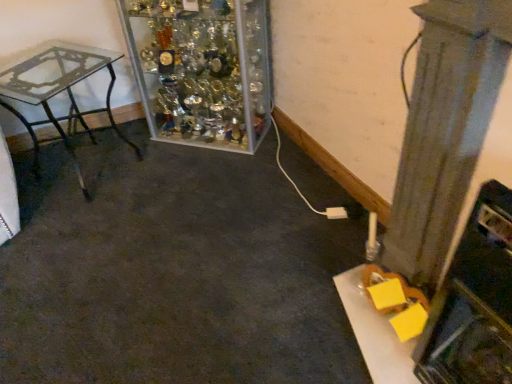
Question: Is smooth gray pillar at right to the right of clear glass table at left from the viewer's perspective?

Choices:
 (A) no
 (B) yes

Answer: (B)

Question: From a real-world perspective, does smooth gray pillar at right stand above clear glass table at left?

Choices:
 (A) no
 (B) yes

Answer: (B)

Question: Is clear glass table at left at the back of smooth gray pillar at right?

Choices:
 (A) yes
 (B) no

Answer: (B)

Question: Can you confirm if smooth gray pillar at right is taller than clear glass table at left?

Choices:
 (A) no
 (B) yes

Answer: (B)

Question: Does smooth gray pillar at right have a lesser height compared to clear glass table at left?

Choices:
 (A) no
 (B) yes

Answer: (A)

Question: Can you confirm if smooth gray pillar at right is bigger than clear glass table at left?

Choices:
 (A) yes
 (B) no

Answer: (B)

Question: From a real-world perspective, is smooth gray pillar at right located higher than clear glass trophy case at upper center?

Choices:
 (A) no
 (B) yes

Answer: (B)

Question: Can you confirm if smooth gray pillar at right is thinner than clear glass trophy case at upper center?

Choices:
 (A) no
 (B) yes

Answer: (B)

Question: From the image's perspective, is smooth gray pillar at right under clear glass trophy case at upper center?

Choices:
 (A) yes
 (B) no

Answer: (A)

Question: Does smooth gray pillar at right have a larger size compared to clear glass trophy case at upper center?

Choices:
 (A) no
 (B) yes

Answer: (A)

Question: Is smooth gray pillar at right facing away from clear glass trophy case at upper center?

Choices:
 (A) no
 (B) yes

Answer: (A)

Question: Is smooth gray pillar at right at the right side of clear glass trophy case at upper center?

Choices:
 (A) no
 (B) yes

Answer: (B)

Question: Is clear glass table at left behind clear glass trophy case at upper center?

Choices:
 (A) no
 (B) yes

Answer: (A)